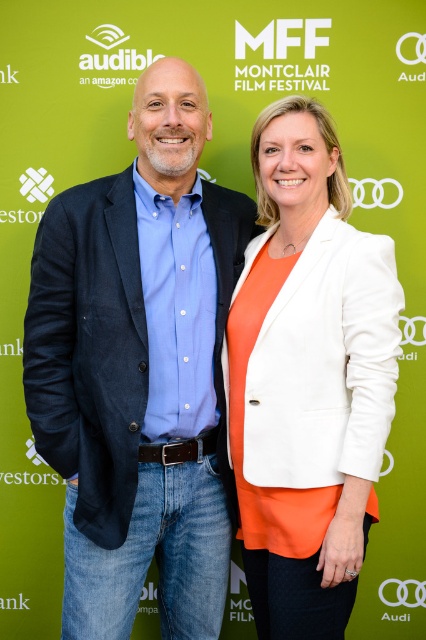
Who is shorter, blue denim jeans at center or white matte blazer at center?

white matte blazer at center

What do you see at coordinates (140, 369) in the screenshot? I see `blue denim jeans at center` at bounding box center [140, 369].

Where is `blue denim jeans at center`? blue denim jeans at center is located at coordinates click(140, 369).